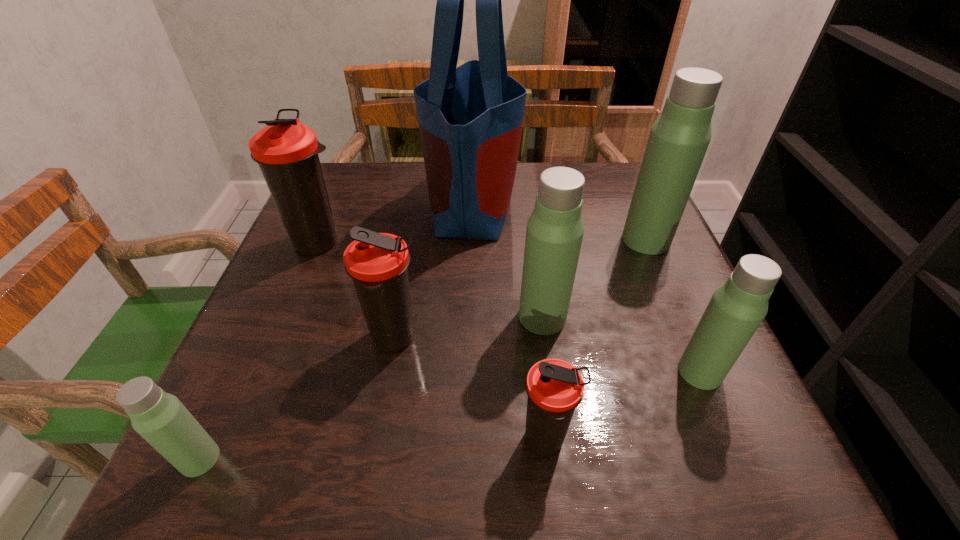
Locate an element on the screen. This screenshot has height=540, width=960. free point that satisfies the following two spatial constraints: 1. on the back side of the third light thermos bottle from right to left; 2. on the right side of the rightmost brown thermos bottle is located at coordinates (532, 317).